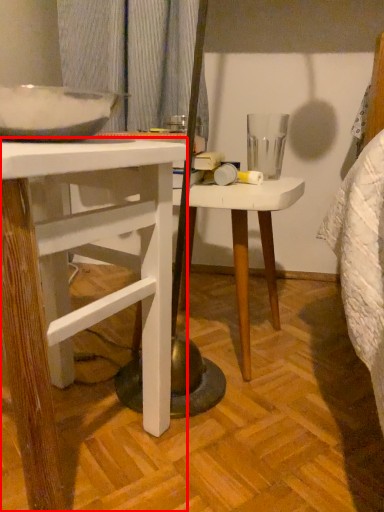
Question: Where is desk (annotated by the red box) located in relation to stool in the image?

Choices:
 (A) right
 (B) left

Answer: (B)